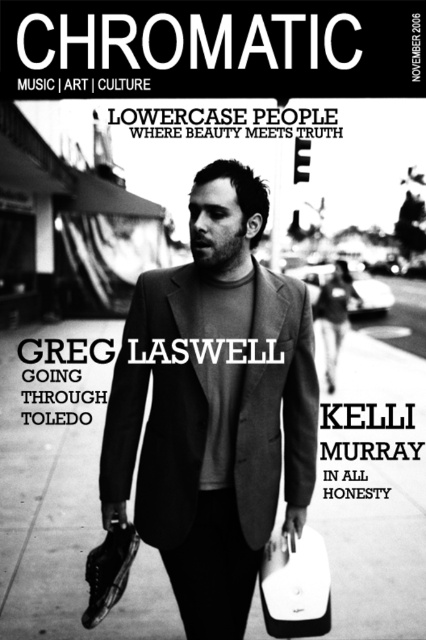
Question: Which point is closer to the camera?

Choices:
 (A) (256, 497)
 (B) (287, 637)

Answer: (B)

Question: Can you confirm if matte black suit at center is thinner than white matte briefcase at lower center?

Choices:
 (A) yes
 (B) no

Answer: (B)

Question: Which point is farther from the camera taking this photo?

Choices:
 (A) (287, 547)
 (B) (138, 435)

Answer: (B)

Question: Does matte black suit at center have a larger size compared to white matte briefcase at lower center?

Choices:
 (A) no
 (B) yes

Answer: (B)

Question: Can you confirm if matte black suit at center is smaller than white matte briefcase at lower center?

Choices:
 (A) no
 (B) yes

Answer: (A)

Question: Which object appears closest to the camera in this image?

Choices:
 (A) white matte briefcase at lower center
 (B) matte black suit at center

Answer: (B)